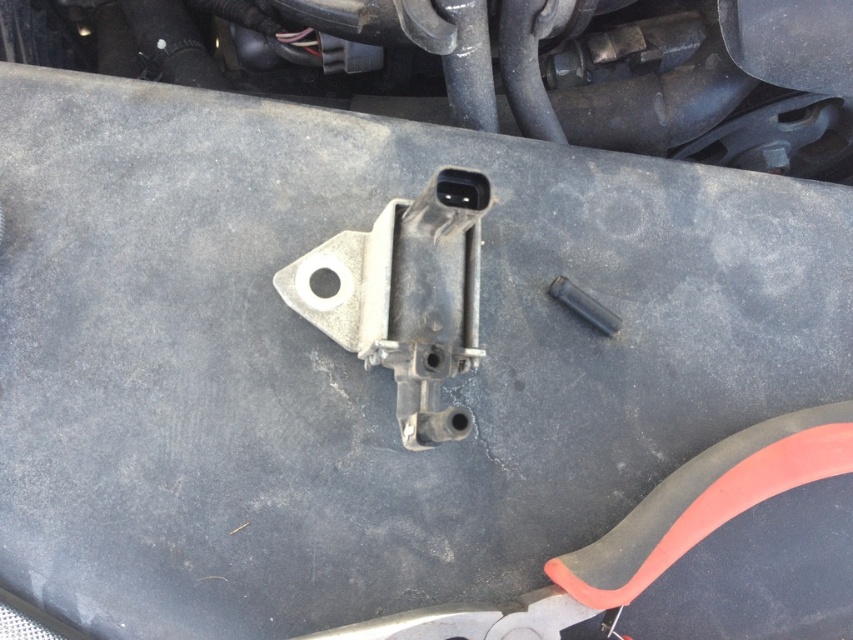
Does point (412, 380) lie behind point (611, 321)?

No.

Between metallic gray bracket at center and black metal bolt at center, which one has less height?

With less height is black metal bolt at center.

In order to click on metallic gray bracket at center in this screenshot , I will do `click(405, 298)`.

The image size is (853, 640). I want to click on metallic gray bracket at center, so click(405, 298).